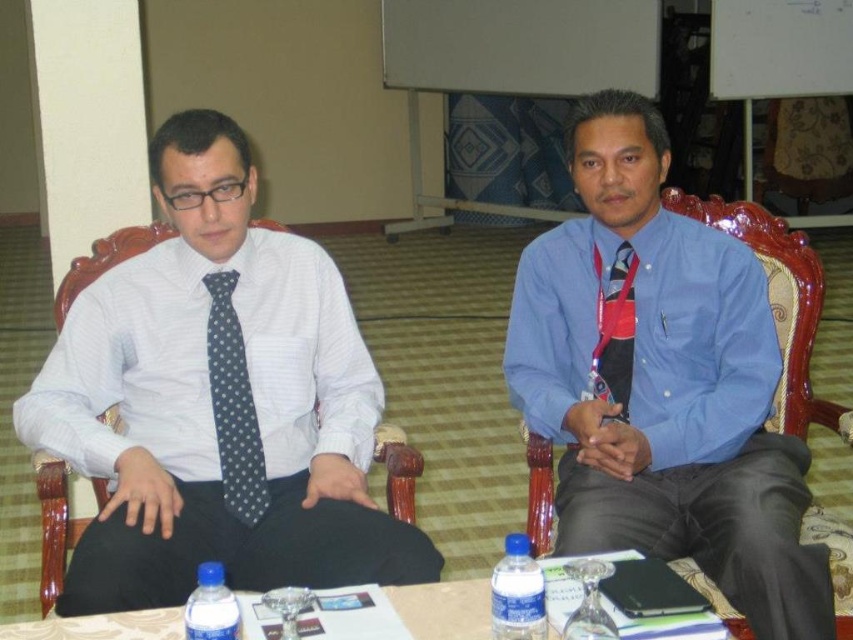
Is point (218, 324) closer to camera compared to point (601, 561)?

No, it is behind (601, 561).

Can you confirm if gray dotted tie at left is thinner than transparent glass bottle at center?

No.

Does point (225, 273) come behind point (577, 557)?

Yes, it is behind point (577, 557).

Locate an element on the screen. gray dotted tie at left is located at coordinates (233, 404).

Is polka dot fabric tie at center positioned at the back of blue plastic bottle at lower left?

Yes, polka dot fabric tie at center is further from the viewer.

Where is `polka dot fabric tie at center`? This screenshot has width=853, height=640. polka dot fabric tie at center is located at coordinates (614, 330).

Based on the photo, can you confirm if gray dotted tie at left is positioned to the left of polka dot fabric tie at center?

Yes, gray dotted tie at left is to the left of polka dot fabric tie at center.

Looking at this image, can you confirm if gray dotted tie at left is positioned above polka dot fabric tie at center?

No, gray dotted tie at left is not above polka dot fabric tie at center.

Is point (242, 435) positioned before point (619, 362)?

Yes, it is.

Locate an element on the screen. The height and width of the screenshot is (640, 853). gray dotted tie at left is located at coordinates (233, 404).